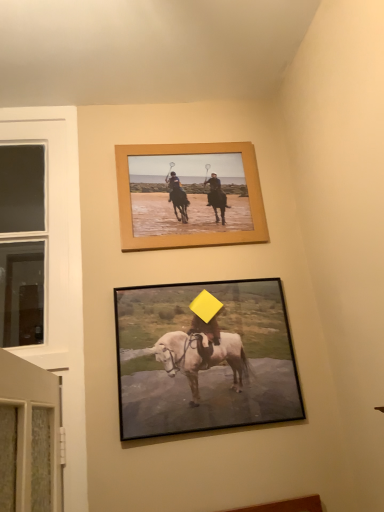
Question: Should I look upward or downward to see matte black horse at center, which is the 2th picture frame from back to front?

Choices:
 (A) up
 (B) down

Answer: (B)

Question: Is matte black horse at center, the second picture frame viewed from the top, oriented towards wooden frame at upper center, which is counted as the 2th picture frame, starting from the front?

Choices:
 (A) yes
 (B) no

Answer: (B)

Question: Does matte black horse at center, the second picture frame viewed from the top, appear on the right side of wooden frame at upper center, which is counted as the 2th picture frame, starting from the front?

Choices:
 (A) yes
 (B) no

Answer: (A)

Question: Does matte black horse at center, which is the first picture frame from bottom to top, have a smaller size compared to wooden frame at upper center, which is the first picture frame from back to front?

Choices:
 (A) yes
 (B) no

Answer: (B)

Question: Does matte black horse at center, which is the 2th picture frame from back to front, contain wooden frame at upper center, which is counted as the 2th picture frame, starting from the front?

Choices:
 (A) yes
 (B) no

Answer: (B)

Question: Is matte black horse at center, which is the 2th picture frame from back to front, far away from wooden frame at upper center, which is counted as the 2th picture frame, starting from the front?

Choices:
 (A) no
 (B) yes

Answer: (A)

Question: From a real-world perspective, is matte black horse at center, the 1th picture frame from the front, located beneath wooden frame at upper center, which is the first picture frame from back to front?

Choices:
 (A) no
 (B) yes

Answer: (B)

Question: Does wooden frame at upper center, which is the first picture frame from back to front, touch matte black horse at center, which is the first picture frame from bottom to top?

Choices:
 (A) yes
 (B) no

Answer: (B)

Question: Can matte black horse at center, which is the first picture frame from bottom to top, be found inside wooden frame at upper center, acting as the second picture frame starting from the bottom?

Choices:
 (A) yes
 (B) no

Answer: (B)

Question: Is wooden frame at upper center, which is the first picture frame from back to front, taller than matte black horse at center, which is the 2th picture frame from back to front?

Choices:
 (A) no
 (B) yes

Answer: (A)

Question: Is wooden frame at upper center, which is counted as the 2th picture frame, starting from the front, turned away from matte black horse at center, the 1th picture frame from the front?

Choices:
 (A) no
 (B) yes

Answer: (A)

Question: Is wooden frame at upper center, which is counted as the 2th picture frame, starting from the front, to the left of matte black horse at center, which is the 2th picture frame from back to front, from the viewer's perspective?

Choices:
 (A) yes
 (B) no

Answer: (A)

Question: From the image's perspective, would you say wooden frame at upper center, positioned as the 1th picture frame in top-to-bottom order, is shown under matte black horse at center, which is the 2th picture frame from back to front?

Choices:
 (A) no
 (B) yes

Answer: (A)

Question: Considering their positions, is wooden frame at upper center, acting as the second picture frame starting from the bottom, located in front of or behind matte black horse at center, the 1th picture frame from the front?

Choices:
 (A) behind
 (B) front

Answer: (A)